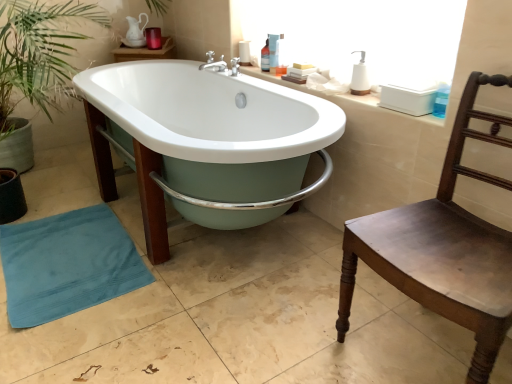
Locate an element on the screen. Image resolution: width=512 pixels, height=384 pixels. white ceramic counter top at upper right is located at coordinates (346, 99).

This screenshot has width=512, height=384. Describe the element at coordinates (346, 99) in the screenshot. I see `white ceramic counter top at upper right` at that location.

Locate an element on the screen. The image size is (512, 384). white glossy bathtub at center is located at coordinates (216, 127).

Locate an element on the screen. Image resolution: width=512 pixels, height=384 pixels. white matte soap dispenser at upper right, the 1th toiletry when ordered from right to left is located at coordinates click(360, 77).

What do you see at coordinates (360, 77) in the screenshot? This screenshot has height=384, width=512. I see `white matte soap dispenser at upper right, arranged as the 1th toiletry when viewed from the front` at bounding box center [360, 77].

Identify the location of translucent plastic soap dispenser at upper center, which ranks as the third toiletry in back-to-front order. (281, 56).

The image size is (512, 384). I want to click on blue terry cloth beach towel at lower left, so click(x=67, y=264).

Considering the sizes of objects white ceramic counter top at upper right and translucent plastic bottle at upper center, which appears as the 1th toiletry when viewed from the back, in the image provided, who is thinner, white ceramic counter top at upper right or translucent plastic bottle at upper center, which appears as the 1th toiletry when viewed from the back,?

translucent plastic bottle at upper center, which appears as the 1th toiletry when viewed from the back.

From the image's perspective, which one is positioned higher, white ceramic counter top at upper right or translucent plastic bottle at upper center, placed as the 4th toiletry when sorted from front to back?

From the image's view, translucent plastic bottle at upper center, placed as the 4th toiletry when sorted from front to back, is above.

From a real-world perspective, is white ceramic counter top at upper right over translucent plastic bottle at upper center, placed as the 4th toiletry when sorted from front to back?

No.

Can you tell me how much white ceramic counter top at upper right and translucent plastic bottle at upper center, which is the first toiletry from left to right, differ in facing direction?

They differ by 1.52 degrees in their facing directions.

Does white ceramic counter top at upper right lie behind translucent plastic soap dispenser at upper center, the 3th toiletry when ordered from right to left?

No, it is not.

Is point (413, 118) closer or farther from the camera than point (273, 64)?

Clearly, point (413, 118) is closer to the camera than point (273, 64).

From a real-world perspective, relative to translucent plastic soap dispenser at upper center, arranged as the third toiletry when viewed from the front, is white ceramic counter top at upper right vertically above or below?

Clearly, from a real-world perspective, white ceramic counter top at upper right is below translucent plastic soap dispenser at upper center, arranged as the third toiletry when viewed from the front.

This screenshot has height=384, width=512. In order to click on toiletry that is the 3rd one above the white ceramic counter top at upper right (from a real-world perspective) in this screenshot , I will do `click(273, 49)`.

From a real-world perspective, does blue terry cloth beach towel at lower left sit lower than white matte soap dispenser at upper right, the 1th toiletry when ordered from right to left?

Yes, from a real-world perspective, blue terry cloth beach towel at lower left is beneath white matte soap dispenser at upper right, the 1th toiletry when ordered from right to left.

Is blue terry cloth beach towel at lower left positioned behind white matte soap dispenser at upper right, the 4th toiletry positioned from the back?

No, blue terry cloth beach towel at lower left is closer to the viewer.

From the picture: Choose the correct answer: Is blue terry cloth beach towel at lower left inside white matte soap dispenser at upper right, the 1th toiletry when ordered from right to left, or outside it?

blue terry cloth beach towel at lower left is not enclosed by white matte soap dispenser at upper right, the 1th toiletry when ordered from right to left.

Between blue terry cloth beach towel at lower left and white matte soap dispenser at upper right, arranged as the 1th toiletry when viewed from the front, which one has smaller width?

white matte soap dispenser at upper right, arranged as the 1th toiletry when viewed from the front.

Is translucent plastic soap dispenser at upper center, the 3th toiletry when ordered from right to left, smaller than translucent plastic bottle at upper center, placed as the 4th toiletry when sorted from right to left?

Yes, translucent plastic soap dispenser at upper center, the 3th toiletry when ordered from right to left, is smaller than translucent plastic bottle at upper center, placed as the 4th toiletry when sorted from right to left.

Considering their positions, is translucent plastic soap dispenser at upper center, the 2th toiletry positioned from the left, located in front of or behind translucent plastic bottle at upper center, which is the first toiletry from left to right?

translucent plastic soap dispenser at upper center, the 2th toiletry positioned from the left, is positioned closer to the viewer than translucent plastic bottle at upper center, which is the first toiletry from left to right.

From the image's perspective, is translucent plastic soap dispenser at upper center, the 2th toiletry positioned from the left, located above or below translucent plastic bottle at upper center, placed as the 4th toiletry when sorted from right to left?

Based on their image positions, translucent plastic soap dispenser at upper center, the 2th toiletry positioned from the left, is located beneath translucent plastic bottle at upper center, placed as the 4th toiletry when sorted from right to left.

Is point (273, 45) positioned in front of point (265, 70)?

Yes.

From a real-world perspective, is blue terry cloth beach towel at lower left physically located above or below translucent plastic soap dispenser at upper center, arranged as the third toiletry when viewed from the front?

In terms of real-world spatial position, blue terry cloth beach towel at lower left is below translucent plastic soap dispenser at upper center, arranged as the third toiletry when viewed from the front.

Would you say blue terry cloth beach towel at lower left is a long distance from translucent plastic soap dispenser at upper center, the 3th toiletry when ordered from right to left?

Indeed, blue terry cloth beach towel at lower left is not near translucent plastic soap dispenser at upper center, the 3th toiletry when ordered from right to left.

Which of these two, blue terry cloth beach towel at lower left or translucent plastic soap dispenser at upper center, arranged as the third toiletry when viewed from the front, is bigger?

blue terry cloth beach towel at lower left.

Would you say translucent plastic soap dispenser at upper center, the second toiletry when ordered from back to front, is to the left or to the right of white ceramic counter top at upper right in the picture?

translucent plastic soap dispenser at upper center, the second toiletry when ordered from back to front, is to the left of white ceramic counter top at upper right.

Is point (275, 50) farther from viewer compared to point (387, 111)?

Yes.

Is translucent plastic soap dispenser at upper center, the 3th toiletry when ordered from right to left, positioned with its back to white ceramic counter top at upper right?

No.

In the scene shown: Which object is more forward, translucent plastic soap dispenser at upper center, the 3th toiletry when ordered from right to left, or white ceramic counter top at upper right?

Positioned in front is white ceramic counter top at upper right.

Does blue terry cloth beach towel at lower left turn towards brown wooden chair at right?

No, blue terry cloth beach towel at lower left is not facing towards brown wooden chair at right.

Does point (68, 269) appear closer or farther from the camera than point (485, 280)?

Point (68, 269).

Which is more to the right, blue terry cloth beach towel at lower left or brown wooden chair at right?

brown wooden chair at right is more to the right.

Between blue terry cloth beach towel at lower left and brown wooden chair at right, which one has more height?

Standing taller between the two is brown wooden chair at right.

Where is `counter top in front of the translucent plastic bottle at upper center, which appears as the 1th toiletry when viewed from the back`? Image resolution: width=512 pixels, height=384 pixels. counter top in front of the translucent plastic bottle at upper center, which appears as the 1th toiletry when viewed from the back is located at coordinates (346, 99).

Image resolution: width=512 pixels, height=384 pixels. I want to click on counter top below the translucent plastic soap dispenser at upper center, the 2th toiletry positioned from the left (from a real-world perspective), so (346, 99).

From the image, which object appears to be farther from brown wooden chair at right, translucent plastic soap dispenser at upper center, which ranks as the third toiletry in back-to-front order, or translucent plastic soap dispenser at upper center, the 3th toiletry when ordered from right to left?

translucent plastic soap dispenser at upper center, the 3th toiletry when ordered from right to left.

Considering their positions, is translucent plastic soap dispenser at upper center, the second toiletry when ordered from back to front, positioned further to brown wooden chair at right than white ceramic counter top at upper right?

Among the two, translucent plastic soap dispenser at upper center, the second toiletry when ordered from back to front, is located further to brown wooden chair at right.

Estimate the real-world distances between objects in this image. Which object is closer to white ceramic counter top at upper right, translucent plastic soap dispenser at upper center, the second toiletry when ordered from back to front, or blue terry cloth beach towel at lower left?

Among the two, translucent plastic soap dispenser at upper center, the second toiletry when ordered from back to front, is located nearer to white ceramic counter top at upper right.

Consider the image. Looking at the image, which one is located closer to white matte soap dispenser at upper right, arranged as the 1th toiletry when viewed from the front, translucent plastic bottle at upper center, placed as the 4th toiletry when sorted from right to left, or blue terry cloth beach towel at lower left?

Among the two, translucent plastic bottle at upper center, placed as the 4th toiletry when sorted from right to left, is located nearer to white matte soap dispenser at upper right, arranged as the 1th toiletry when viewed from the front.

Looking at the image, which one is located further to white glossy bathtub at center, white ceramic counter top at upper right or white matte soap dispenser at upper right, the 1th toiletry when ordered from right to left?

Based on the image, white matte soap dispenser at upper right, the 1th toiletry when ordered from right to left, appears to be further to white glossy bathtub at center.

From the image, which object appears to be farther from white ceramic counter top at upper right, brown wooden chair at right or translucent plastic soap dispenser at upper center, the second toiletry when ordered from front to back?

The object further to white ceramic counter top at upper right is brown wooden chair at right.

Based on their spatial positions, is blue terry cloth beach towel at lower left or translucent plastic bottle at upper center, which is the first toiletry from left to right, closer to white matte soap dispenser at upper right, which is counted as the fourth toiletry, starting from the left?

translucent plastic bottle at upper center, which is the first toiletry from left to right, is closer to white matte soap dispenser at upper right, which is counted as the fourth toiletry, starting from the left.

Considering their positions, is brown wooden chair at right positioned further to translucent plastic bottle at upper center, placed as the 4th toiletry when sorted from right to left, than white glossy bathtub at center?

brown wooden chair at right lies further to translucent plastic bottle at upper center, placed as the 4th toiletry when sorted from right to left, than the other object.

Locate an element on the screen. The height and width of the screenshot is (384, 512). counter top situated between white glossy bathtub at center and white matte soap dispenser at upper right, arranged as the 1th toiletry when viewed from the front, from left to right is located at coordinates (346, 99).

Identify the location of counter top positioned between brown wooden chair at right and translucent plastic bottle at upper center, which is the first toiletry from left to right, from near to far. 346,99.

The width and height of the screenshot is (512, 384). In order to click on toiletry positioned between white matte soap dispenser at upper right, arranged as the 1th toiletry when viewed from the front, and translucent plastic soap dispenser at upper center, the 2th toiletry positioned from the left, from near to far in this screenshot , I will do `click(281, 56)`.

The image size is (512, 384). In order to click on beach towel between white glossy bathtub at center and translucent plastic bottle at upper center, placed as the 4th toiletry when sorted from right to left, from front to back in this screenshot , I will do `click(67, 264)`.